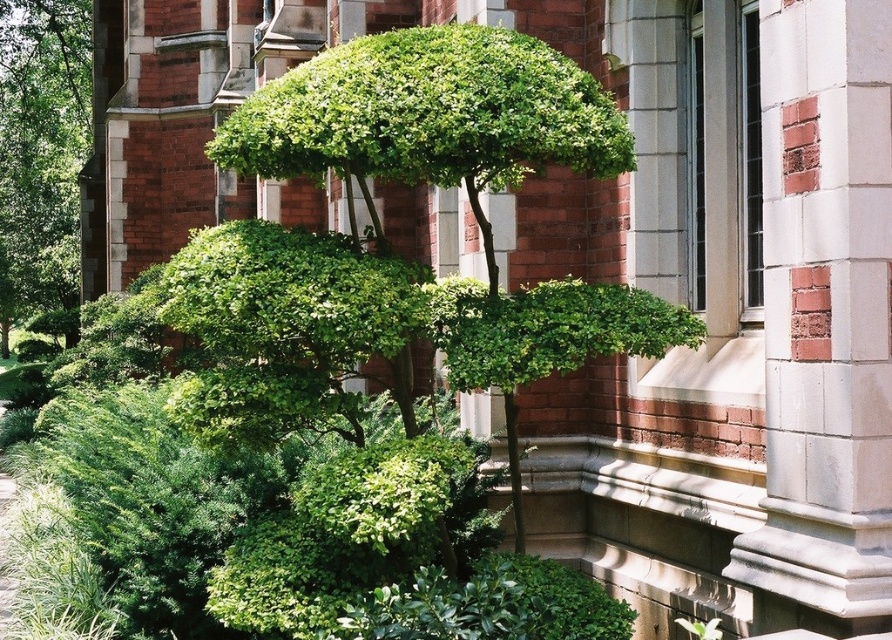
You are a landscape architect designing a garden layout. You need to place a small statue between the green leafy bush at center and the green leafy bush at left. Which bush should the statue be closer to in order to maintain balance in the garden design?

The green leafy bush at center occupies less space than the green leafy bush at left, so the statue should be placed closer to the green leafy bush at center to balance the visual weight.

You are standing in front of the building and want to water the green leafy bush at center and the green leafy bush at left. Which bush should you water first if you want to start with the one nearest to you?

You should water the green leafy bush at center first because it is closer to you than the green leafy bush at left.

You are standing in front of the building and notice a point marked at coordinates (288,330). Based on the scene description, what object is located at this point?

The point at coordinates (288,330) corresponds to the green leafy bush at center.